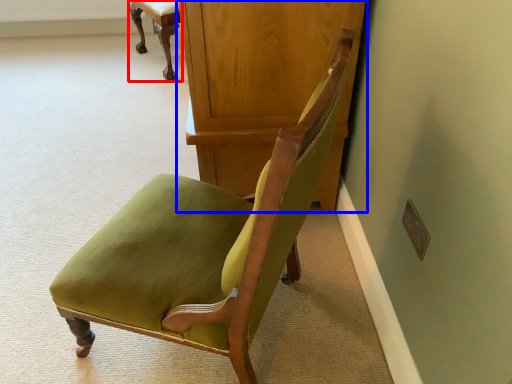
Question: Which object appears closest to the camera in this image, chair (highlighted by a red box) or dresser (highlighted by a blue box)?

Choices:
 (A) chair
 (B) dresser

Answer: (B)